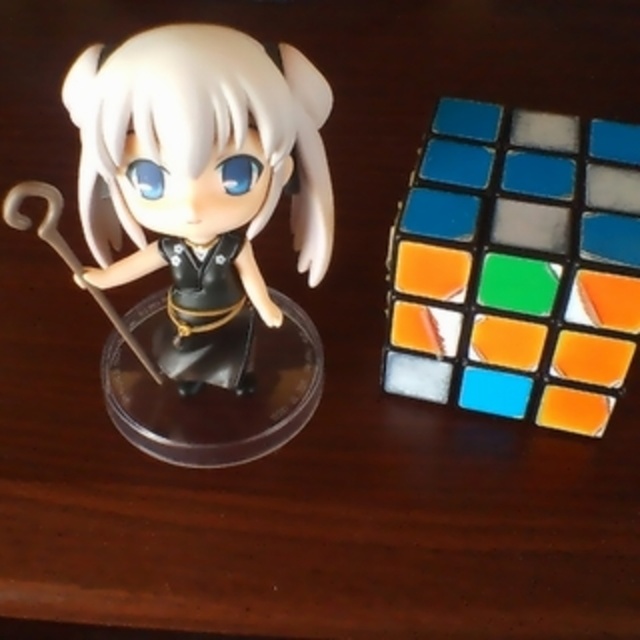
You are organizing a display on a shelf and need to place both the satin black figurine at left and the matte gray cube at center right. If the shelf has a width of 30 cm and the distance between the two objects is currently 10 cm, can both items fit on the shelf without overlapping?

The satin black figurine at left is to the left of the matte gray cube at center right, and the distance between them is 10 cm. Since the shelf is 30 cm wide, both items can fit on the shelf without overlapping as the total space required is less than the shelf width.

In the scene shown: You are organizing a display on a shelf that can only accommodate items up to the size of the matte gray cube at center right. Can the satin black figurine at left fit on the shelf without exceeding the size limit?

The satin black figurine at left is larger than the matte gray cube at center right, so it cannot fit on the shelf within the size limit.